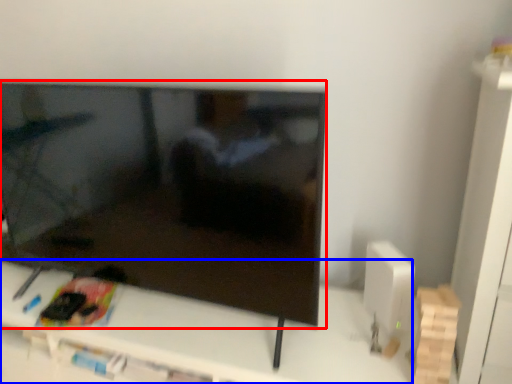
Question: Which object appears closest to the camera in this image, television (highlighted by a red box) or furniture (highlighted by a blue box)?

Choices:
 (A) television
 (B) furniture

Answer: (A)